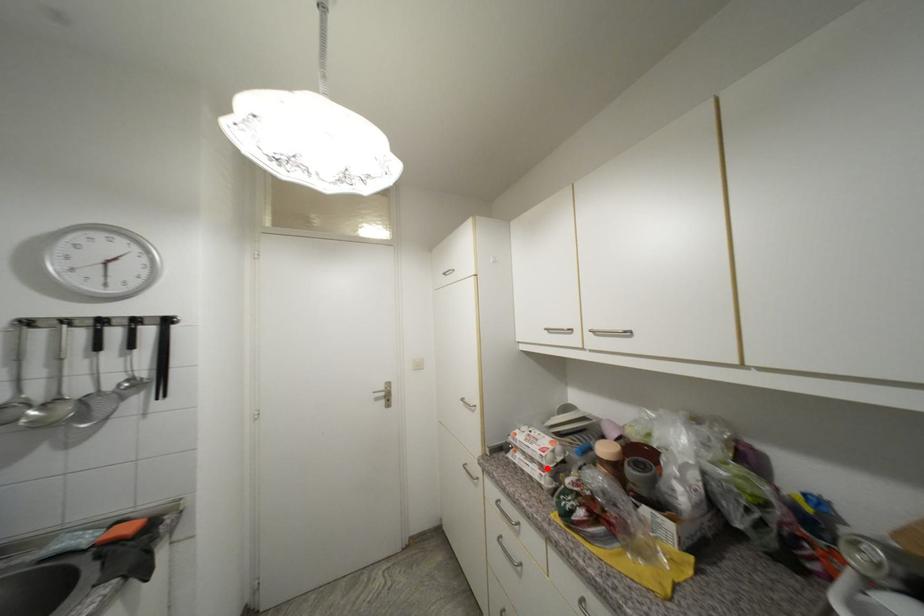
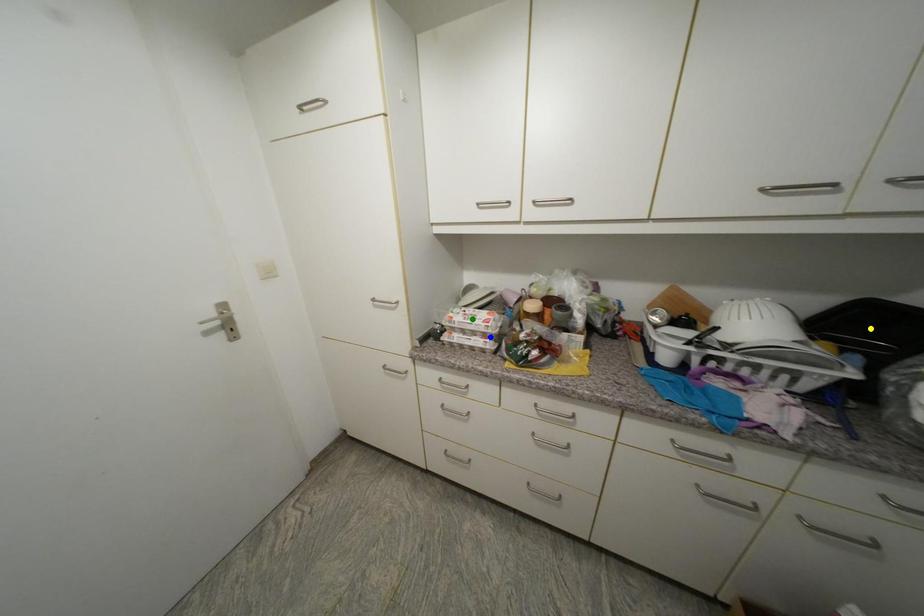
Question: I am providing you with two images of the same scene from different viewpoints. A red point is marked on the first image. You are given multiple points on the second image. Which point in image 2 represents the same 3d spot as the red point in image 1?

Choices:
 (A) green point
 (B) yellow point
 (C) blue point

Answer: (C)